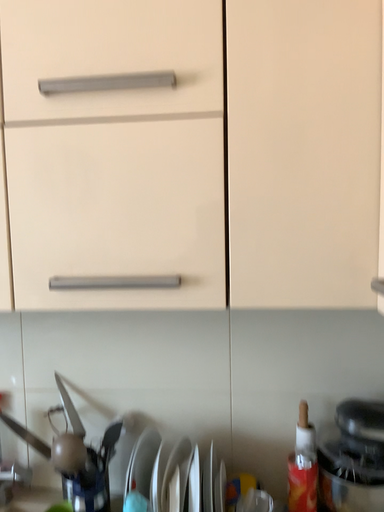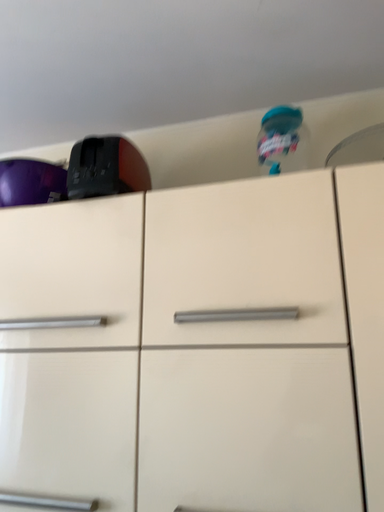
Question: How did the camera likely rotate when shooting the video?

Choices:
 (A) rotated right
 (B) rotated left

Answer: (B)